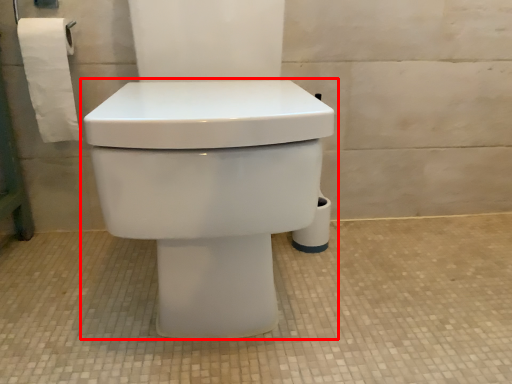
Question: From the image, what is the correct spatial relationship of toilet (annotated by the red box) in relation to toilet paper?

Choices:
 (A) left
 (B) right

Answer: (B)